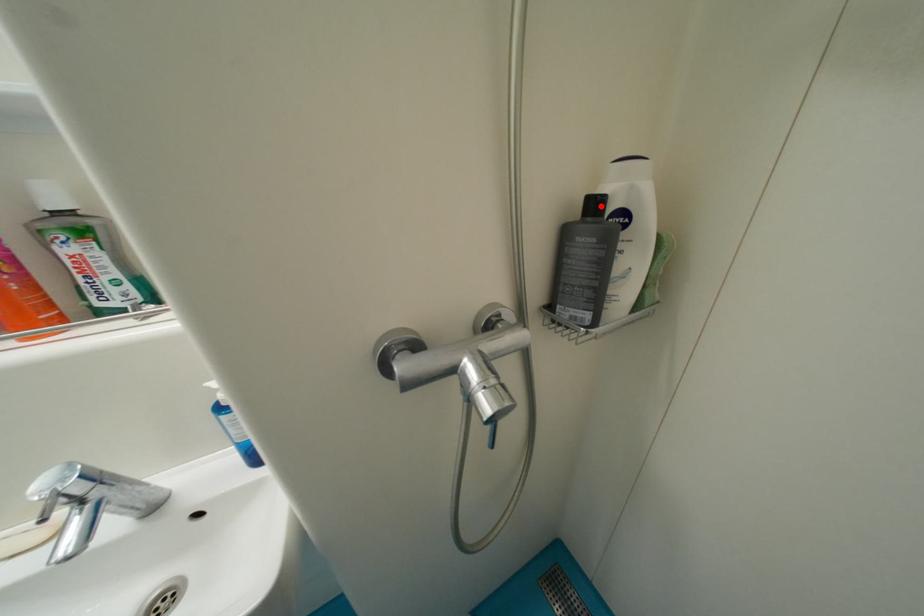
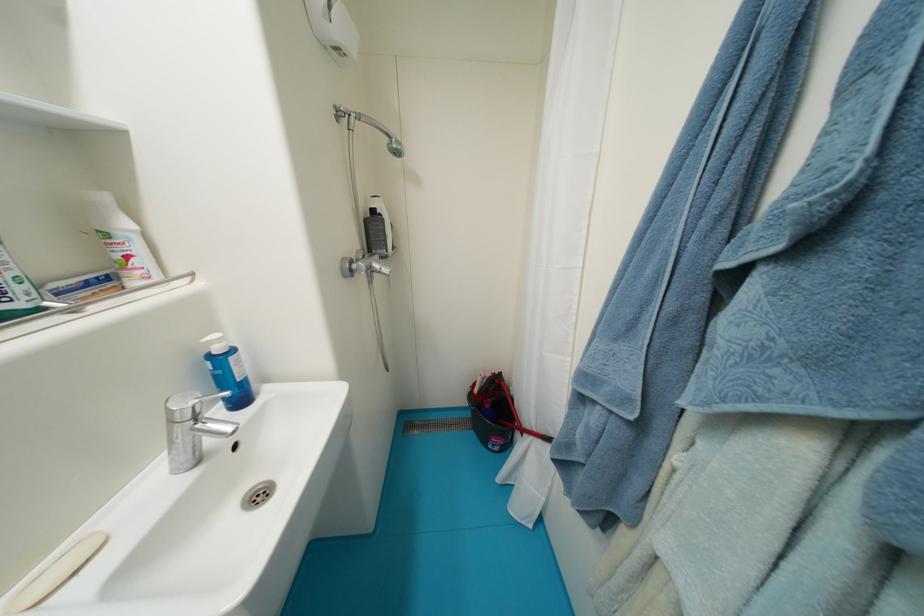
Locate, in the second image, the point that corresponds to the highlighted location in the first image.

(380, 214)